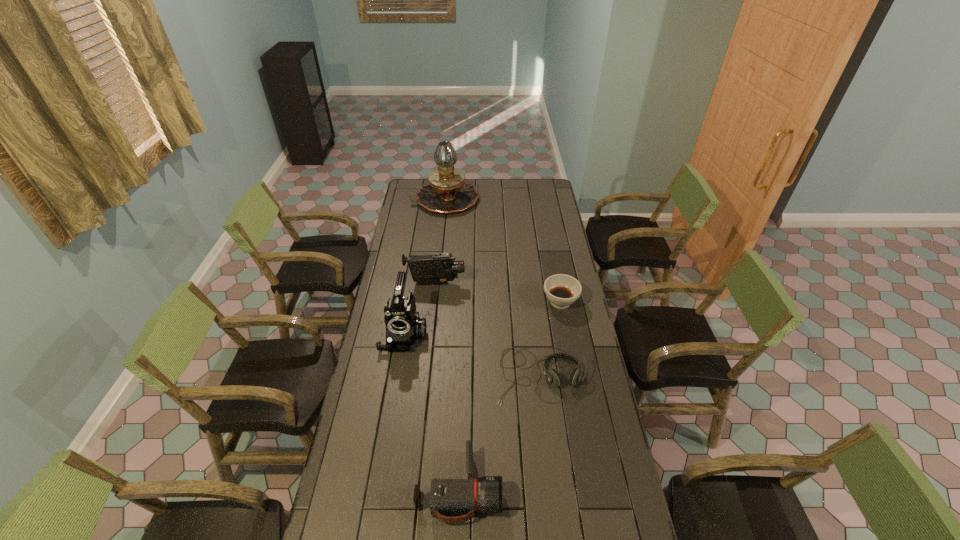
You are a GUI agent. You are given a task and a screenshot of the screen. Output one action in this format:
    pyautogui.click(x=<x>, y=<y>)
    Task: Click on the farthest object
    The image size is (960, 540).
    Given the screenshot: What is the action you would take?
    pyautogui.click(x=447, y=192)

The width and height of the screenshot is (960, 540). In order to click on oil lamp in this screenshot , I will do pos(447,192).

This screenshot has height=540, width=960. I want to click on the tallest camcorder, so click(x=404, y=327).

The width and height of the screenshot is (960, 540). I want to click on the second nearest camcorder, so click(x=404, y=327).

Where is `the second tallest camcorder`? the second tallest camcorder is located at coordinates (439, 268).

In order to click on the third tallest object in this screenshot , I will do `click(439, 268)`.

Identify the location of the nearest object. The image size is (960, 540). pos(448,497).

This screenshot has width=960, height=540. I want to click on the nearest camcorder, so click(448, 497).

At what (x,y) coordinates should I click in order to perform the action: click on soup bowl. Please return your answer as a coordinate pair (x, y). Looking at the image, I should click on (562, 290).

The image size is (960, 540). Identify the location of headset. (552, 375).